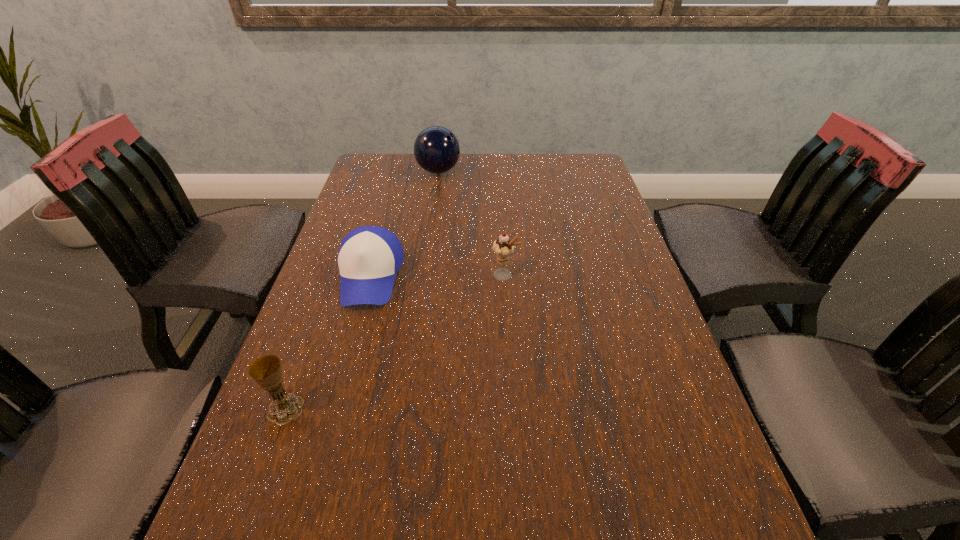
Identify the location of unoccupied position between the icecream and the bowling ball. The height and width of the screenshot is (540, 960). (471, 223).

Locate an element on the screen. free space between the baseball cap and the nearest object is located at coordinates (327, 343).

You are a GUI agent. You are given a task and a screenshot of the screen. Output one action in this format:
    pyautogui.click(x=<x>, y=<y>)
    Task: Click on the vacant region between the shortest object and the chalice
    The height and width of the screenshot is (540, 960).
    Given the screenshot: What is the action you would take?
    pyautogui.click(x=327, y=343)

This screenshot has height=540, width=960. Find the location of `blank region between the rightmost object and the second shortest object`. blank region between the rightmost object and the second shortest object is located at coordinates (396, 342).

The image size is (960, 540). I want to click on blank region between the second shortest object and the baseball cap, so point(327,343).

In order to click on vacant area that lies between the shortest object and the chalice in this screenshot , I will do point(327,343).

At what (x,y) coordinates should I click in order to perform the action: click on free spot between the farthest object and the rightmost object. Please return your answer as a coordinate pair (x, y). Looking at the image, I should click on [x=471, y=223].

Locate which object is the closest to the rightmost object. Please provide its 2D coordinates. Your answer should be formatted as a tuple, i.e. [(x, y)], where the tuple contains the x and y coordinates of a point satisfying the conditions above.

[(369, 257)]

Locate which object ranks third in proximity to the nearest object. Please provide its 2D coordinates. Your answer should be formatted as a tuple, i.e. [(x, y)], where the tuple contains the x and y coordinates of a point satisfying the conditions above.

[(436, 149)]

At what (x,y) coordinates should I click in order to perform the action: click on vacant area that satisfies the following two spatial constraints: 1. on the surface of the bowling ball near the finger holes; 2. on the front-facing side of the shortest object. Please return your answer as a coordinate pair (x, y). This screenshot has height=540, width=960. Looking at the image, I should click on (423, 276).